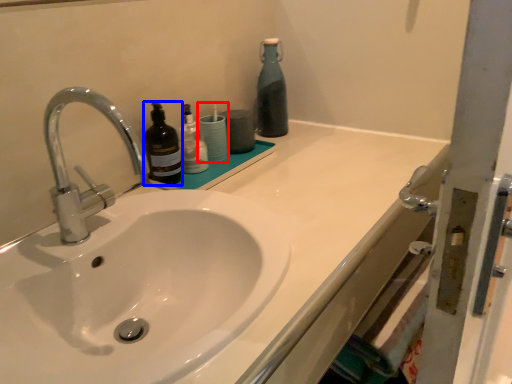
Question: Which object appears farthest to the camera in this image, toiletry (highlighted by a red box) or bottle (highlighted by a blue box)?

Choices:
 (A) toiletry
 (B) bottle

Answer: (A)